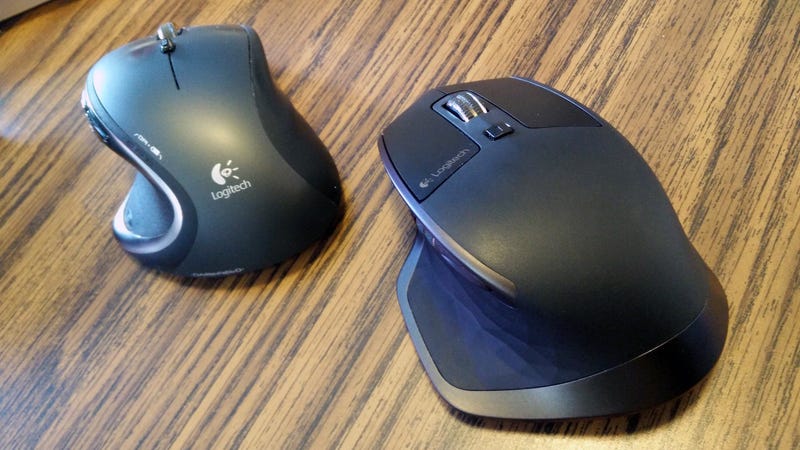
Identify the location of mouse. (478, 245), (268, 180).